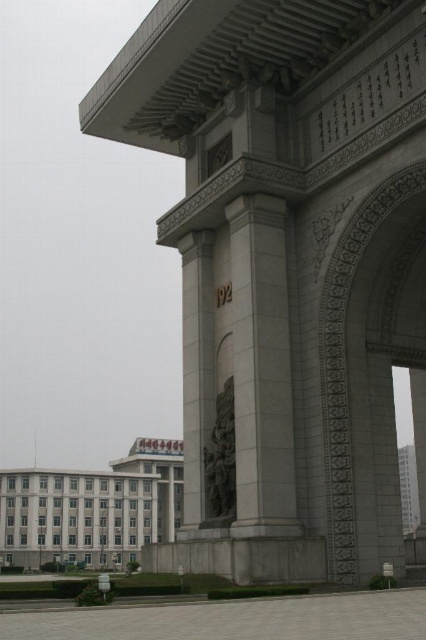
Between white concrete building at lower left and dark gray stone statue at center, which one appears on the right side from the viewer's perspective?

From the viewer's perspective, dark gray stone statue at center appears more on the right side.

Which is more to the left, white concrete building at lower left or dark gray stone statue at center?

Positioned to the left is white concrete building at lower left.

Between point (40, 532) and point (212, 452), which one is positioned in front?

Point (212, 452) is more forward.

Locate an element on the screen. This screenshot has width=426, height=640. white concrete building at lower left is located at coordinates (92, 508).

How much distance is there between white stone column at center and white concrete building at lower left?

The distance of white stone column at center from white concrete building at lower left is 148.87 meters.

Can you confirm if white stone column at center is positioned to the left of white concrete building at lower left?

In fact, white stone column at center is to the right of white concrete building at lower left.

Which is in front, point (285, 310) or point (164, 442)?

Point (285, 310)

Where is `white stone column at center`? white stone column at center is located at coordinates (261, 369).

Does white stone column at center come behind dark gray stone statue at center?

No, white stone column at center is in front of dark gray stone statue at center.

Locate an element on the screen. white stone column at center is located at coordinates (261, 369).